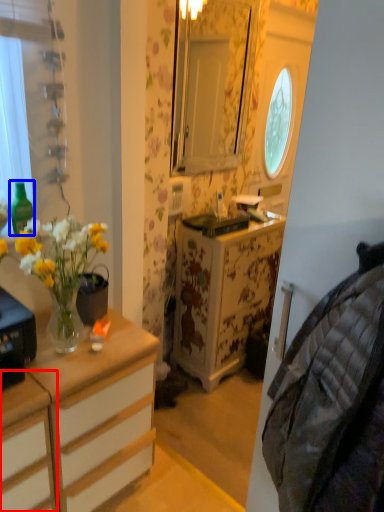
Question: Which object appears closest to the camera in this image, cabinetry (highlighted by a red box) or bottle (highlighted by a blue box)?

Choices:
 (A) cabinetry
 (B) bottle

Answer: (A)